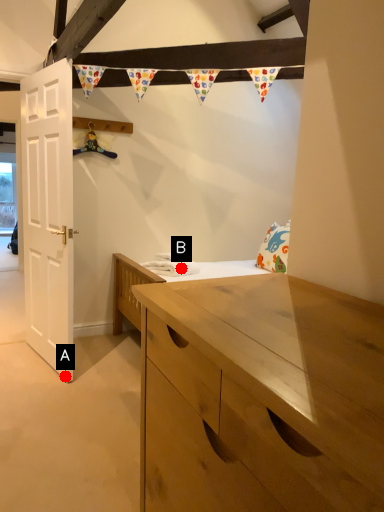
Question: Two points are circled on the image, labeled by A and B beside each circle. Which point is closer to the camera taking this photo?

Choices:
 (A) A is closer
 (B) B is closer

Answer: (A)